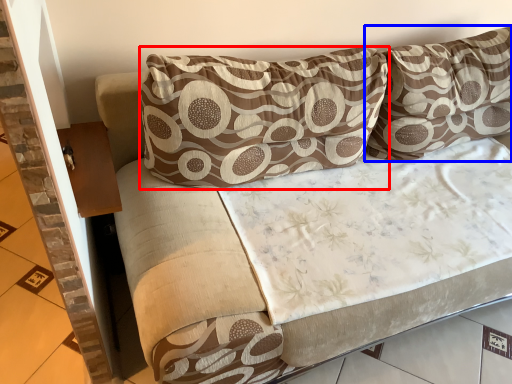
Question: Which object is closer to the camera taking this photo, pillow (highlighted by a red box) or pillow (highlighted by a blue box)?

Choices:
 (A) pillow
 (B) pillow

Answer: (A)